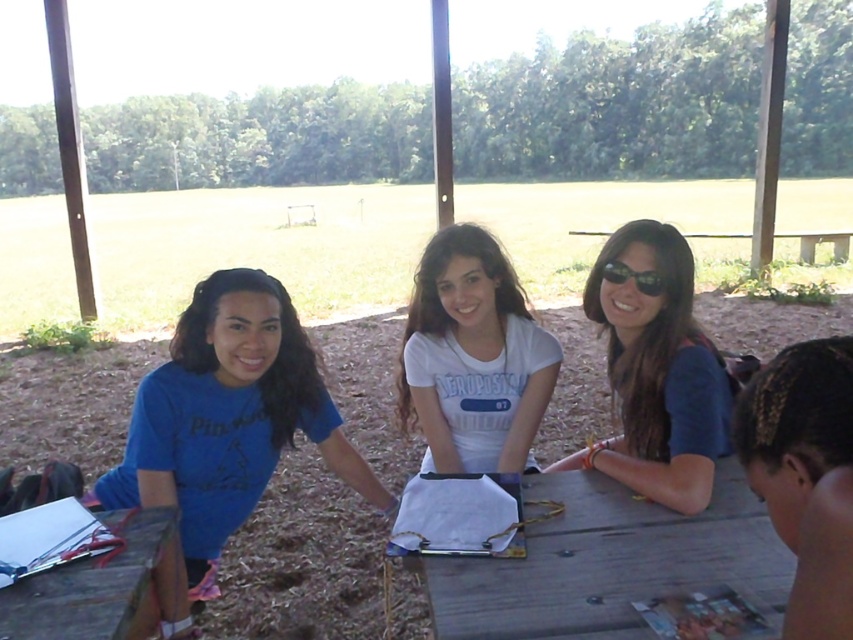
Question: Does matte blue shirt at center appear under dark brown hair at lower right?

Choices:
 (A) no
 (B) yes

Answer: (A)

Question: Estimate the real-world distances between objects in this image. Which object is farther from the wooden picnic table at lower left?

Choices:
 (A) white matte shirt at center
 (B) black plastic sunglasses at upper center

Answer: (B)

Question: Observing the image, what is the correct spatial positioning of matte blue shirt at center in reference to black plastic sunglasses at upper center?

Choices:
 (A) above
 (B) below

Answer: (B)

Question: Is white matte shirt at center positioned in front of dark brown hair at lower right?

Choices:
 (A) no
 (B) yes

Answer: (A)

Question: Among these points, which one is farthest from the camera?

Choices:
 (A) (276, 346)
 (B) (625, 488)

Answer: (A)

Question: Which object appears closest to the camera in this image?

Choices:
 (A) dark brown hair at lower right
 (B) matte blue shirt at center
 (C) wooden table at center
 (D) wooden picnic table at lower left

Answer: (A)